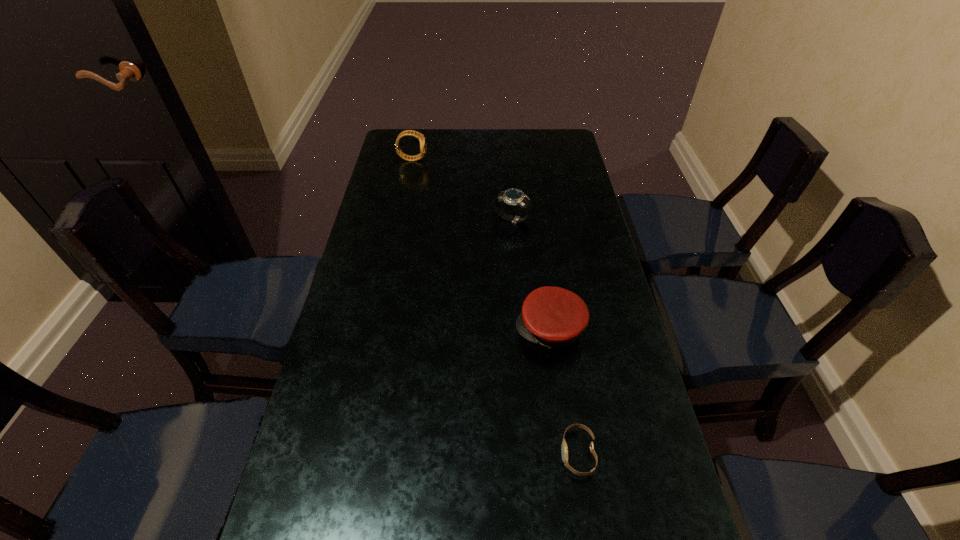
Locate an element on the screen. free spot located 0.300m on the front of the third farthest object with an emblem is located at coordinates (398, 329).

You are a GUI agent. You are given a task and a screenshot of the screen. Output one action in this format:
    pyautogui.click(x=<x>, y=<y>)
    Task: Click on the vacant space located on the front of the third farthest object with an emblem
    
    Given the screenshot: What is the action you would take?
    pyautogui.click(x=461, y=329)

This screenshot has height=540, width=960. In order to click on vacant space positioned 0.280m on the front of the third farthest object with an emblem in this screenshot , I will do `click(406, 329)`.

I want to click on free space located 0.090m on the face of the rightmost watch, so click(x=517, y=453).

You are a GUI agent. You are given a task and a screenshot of the screen. Output one action in this format:
    pyautogui.click(x=<x>, y=<y>)
    Task: Click on the free spot located on the face of the rightmost watch
    The height and width of the screenshot is (540, 960).
    Given the screenshot: What is the action you would take?
    pyautogui.click(x=473, y=453)

Locate an element on the screen. free space located on the face of the rightmost watch is located at coordinates (497, 453).

This screenshot has height=540, width=960. Identify the location of object located at the far edge. (x=422, y=139).

Where is `object that is at the left edge`? object that is at the left edge is located at coordinates (422, 139).

Image resolution: width=960 pixels, height=540 pixels. I want to click on cap positioned at the right edge, so click(x=551, y=316).

What are the coordinates of `watch situated at the right edge` in the screenshot? It's located at (564, 449).